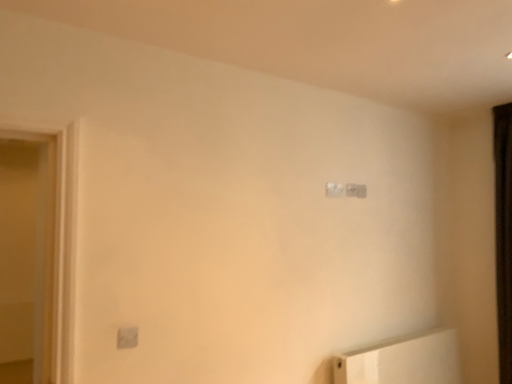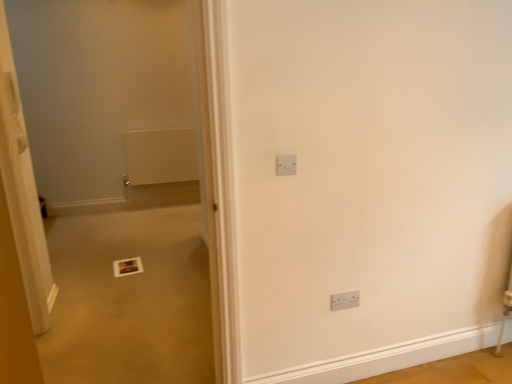
Question: Which way did the camera rotate in the video?

Choices:
 (A) rotated downward
 (B) rotated upward

Answer: (A)